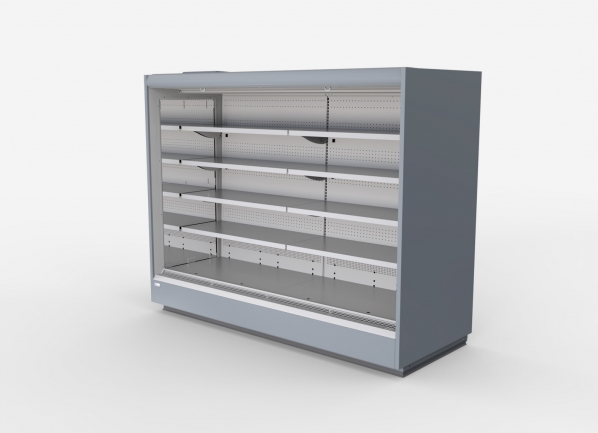
The width and height of the screenshot is (598, 433). Find the location of `the back of cabinet`. the back of cabinet is located at coordinates (279, 182).